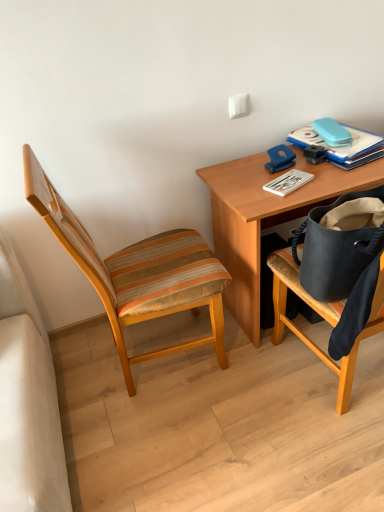
Identify the location of vacant space in front of wooden desk at upper right. This screenshot has height=512, width=384. (267, 411).